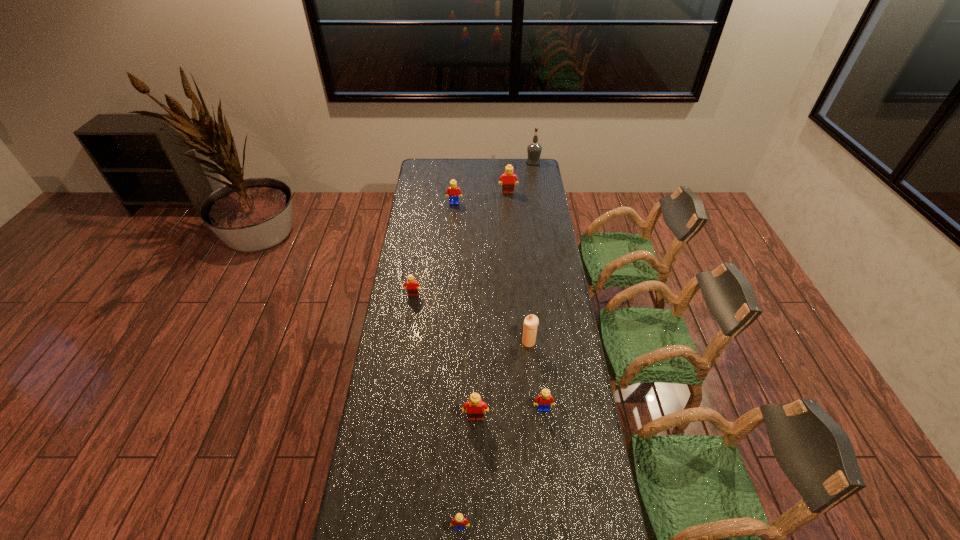
What are the coordinates of `vacant space located 0.070m on the front-facing side of the second Lego from left to right` in the screenshot? It's located at (454, 213).

Locate an element on the screen. The image size is (960, 540). vacant area located on the face of the second smallest brown Lego is located at coordinates (475, 510).

Where is `free space located 0.320m on the face of the smallest brown Lego`? The height and width of the screenshot is (540, 960). free space located 0.320m on the face of the smallest brown Lego is located at coordinates (404, 357).

I want to click on free space located on the front-facing side of the third nearest Lego, so click(552, 492).

Locate an element on the screen. The width and height of the screenshot is (960, 540). object that is at the far edge is located at coordinates (534, 149).

This screenshot has height=540, width=960. I want to click on object that is at the left edge, so click(x=412, y=289).

At what (x,y) coordinates should I click in order to perform the action: click on vodka at the right edge. Please return your answer as a coordinate pair (x, y). Image resolution: width=960 pixels, height=540 pixels. Looking at the image, I should click on (534, 149).

Where is `candle that is at the right edge`? candle that is at the right edge is located at coordinates (531, 322).

Locate an element on the screen. Lego that is at the right edge is located at coordinates (542, 401).

This screenshot has width=960, height=540. I want to click on object that is at the far right corner, so click(x=534, y=149).